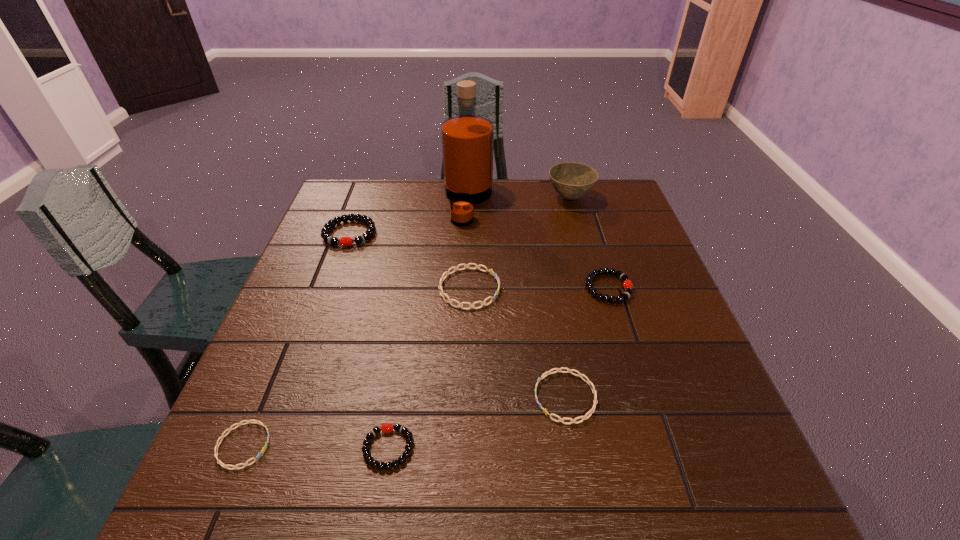
I want to click on vacant position located 0.280m on the surface of the rightmost blue bracelet showing star-shaped elements, so click(389, 397).

Identify the location of free region located on the surface of the rightmost blue bracelet showing star-shaped elements. This screenshot has height=540, width=960. (509, 397).

At what (x,y) coordinates should I click in order to perform the action: click on free space located on the right of the smallest black bracelet. Please return your answer as a coordinate pair (x, y). The height and width of the screenshot is (540, 960). Looking at the image, I should click on (443, 448).

Locate an element on the screen. This screenshot has height=540, width=960. free space located 0.060m on the surface of the shortest bracelet showing star-shaped elements is located at coordinates (303, 446).

Locate an element on the screen. liquor at the far edge is located at coordinates (467, 139).

This screenshot has height=540, width=960. Identify the location of bowl that is at the far edge. (571, 180).

At what (x,y) coordinates should I click in order to perform the action: click on bracelet that is at the far edge. Please return your answer as a coordinate pair (x, y). Image resolution: width=960 pixels, height=540 pixels. Looking at the image, I should click on (x=325, y=231).

Locate an element on the screen. Image resolution: width=960 pixels, height=540 pixels. bowl positioned at the right edge is located at coordinates (571, 180).

Find the location of a particular element. bracelet situated at the right edge is located at coordinates (627, 284).

Identify the location of object present at the far left corner. The width and height of the screenshot is (960, 540). (325, 231).